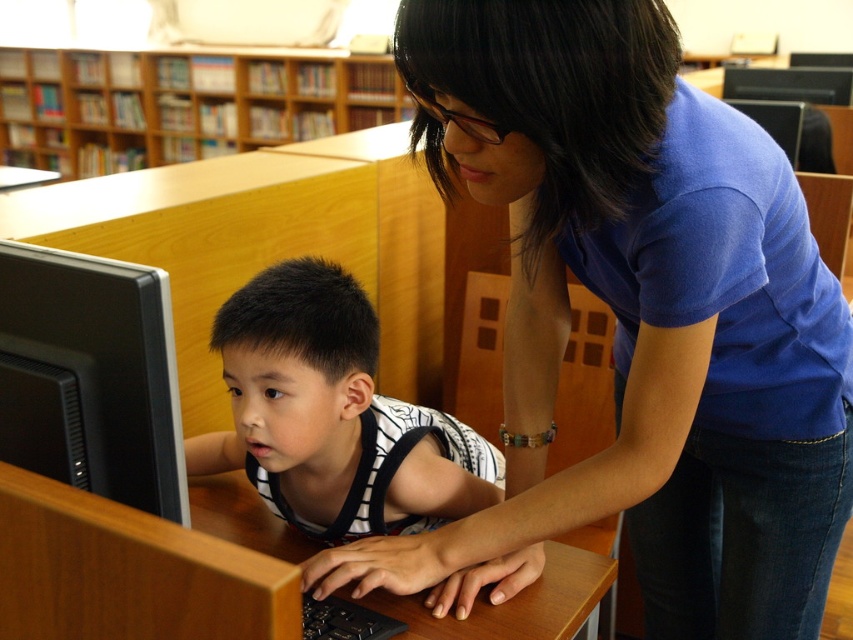
Is point (518, 188) more distant than point (309, 634)?

No, it is not.

Is point (833, 406) positioned before point (328, 614)?

No, (833, 406) is further to viewer.

What are the coordinates of `blue cotton shirt at upper right` in the screenshot? It's located at click(635, 321).

Does blue cotton shirt at upper right appear under white striped shirt at center?

No.

The width and height of the screenshot is (853, 640). I want to click on blue cotton shirt at upper right, so click(x=635, y=321).

Between blue cotton shirt at upper right and wooden bookshelf at upper center, which one has more height?

Standing taller between the two is wooden bookshelf at upper center.

This screenshot has width=853, height=640. Identify the location of blue cotton shirt at upper right. (635, 321).